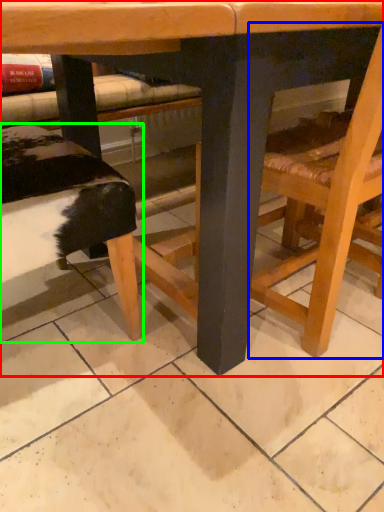
Question: Which is nearer to the table (highlighted by a red box)? chair (highlighted by a blue box) or park bench (highlighted by a green box).

Choices:
 (A) chair
 (B) park bench

Answer: (A)